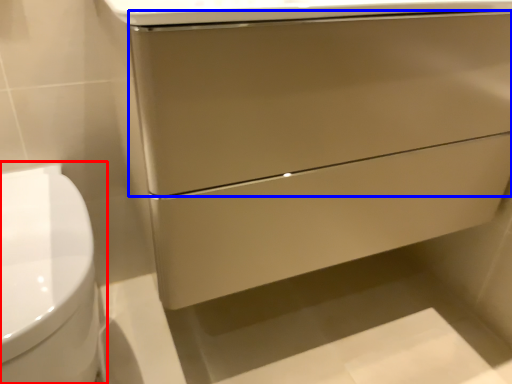
Question: Which object is further to the camera taking this photo, toilet (highlighted by a red box) or drawer (highlighted by a blue box)?

Choices:
 (A) toilet
 (B) drawer

Answer: (B)